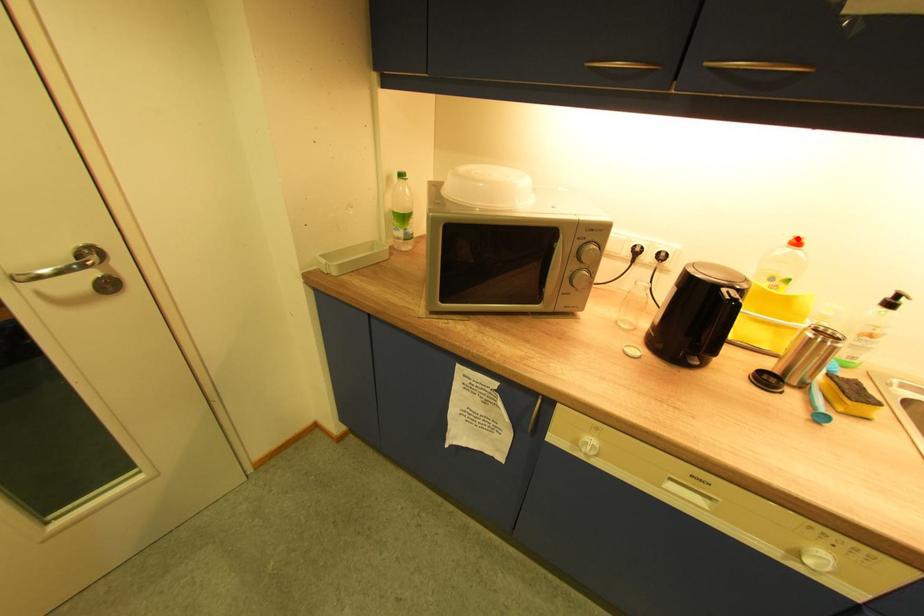
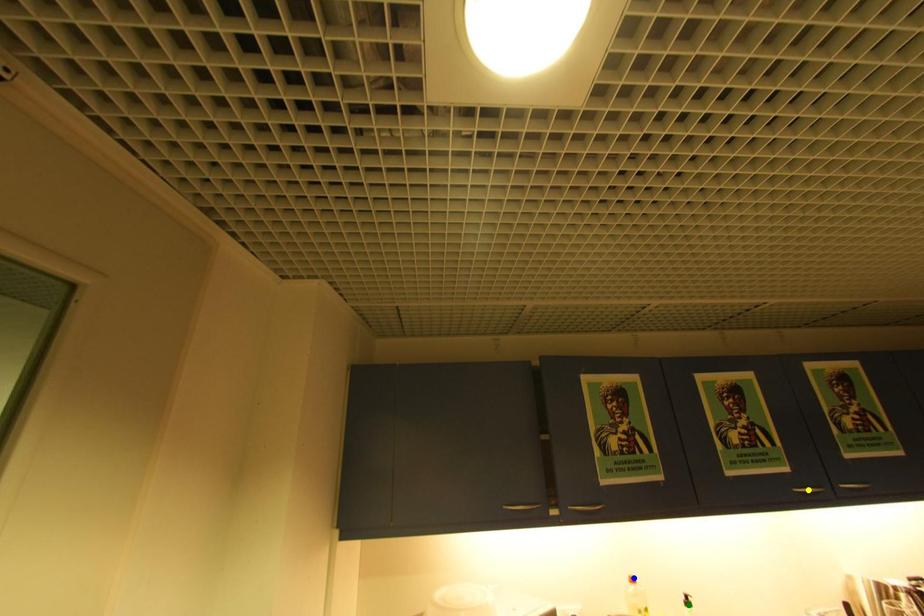
Question: I am providing you with two images of the same scene from different viewpoints. A red point is marked on the first image. You are given multiple points on the second image. Which point in image 2 represents the same 3d spot as the red point in image 1?

Choices:
 (A) green point
 (B) blue point
 (C) yellow point

Answer: (B)